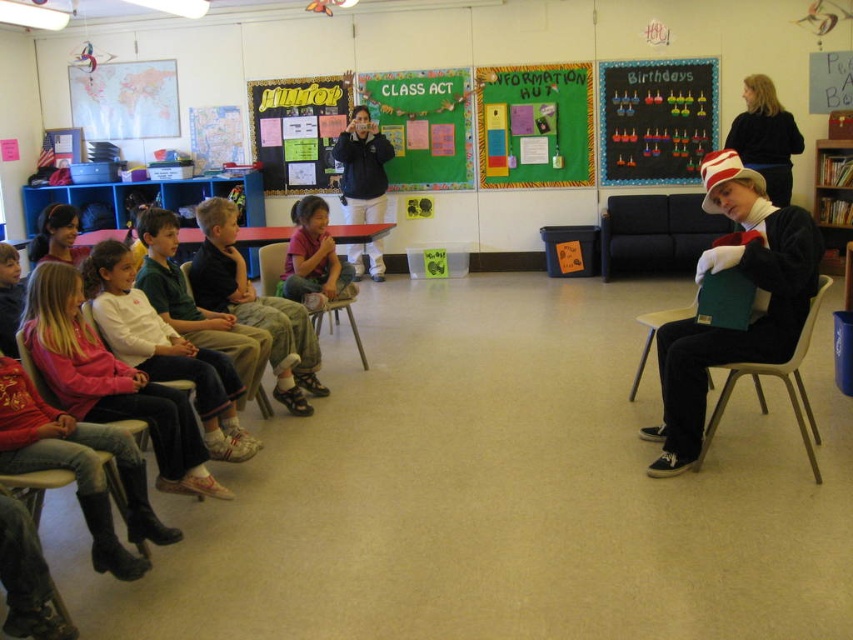
Question: Among these objects, which one is nearest to the camera?

Choices:
 (A) matte black jacket at center
 (B) yellow chalkboard at upper center

Answer: (A)

Question: Which of the following is the farthest from the observer?

Choices:
 (A) (807, 448)
 (B) (283, 90)
 (C) (331, 252)

Answer: (B)

Question: In this image, where is white plush hat at right located relative to matte black jacket at center?

Choices:
 (A) left
 (B) right

Answer: (B)

Question: Can you confirm if matte black book at right is smaller than black sweater at upper right?

Choices:
 (A) yes
 (B) no

Answer: (B)

Question: Does black sweater at upper right appear on the left side of wooden chair at lower left?

Choices:
 (A) yes
 (B) no

Answer: (B)

Question: Which point is farther to the camera?

Choices:
 (A) (762, 168)
 (B) (352, 172)
 (C) (688, 444)
 (D) (258, 394)

Answer: (B)